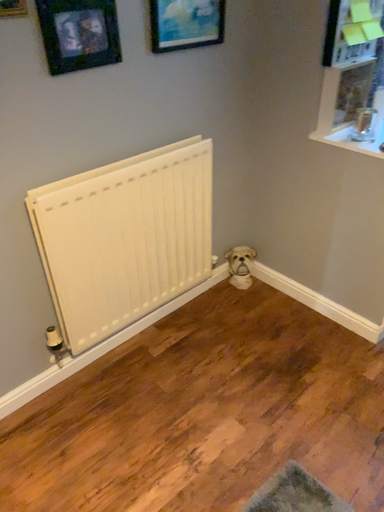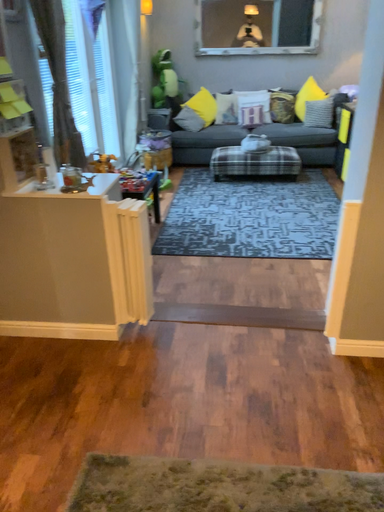
Question: Which way did the camera rotate in the video?

Choices:
 (A) rotated downward
 (B) rotated upward

Answer: (B)